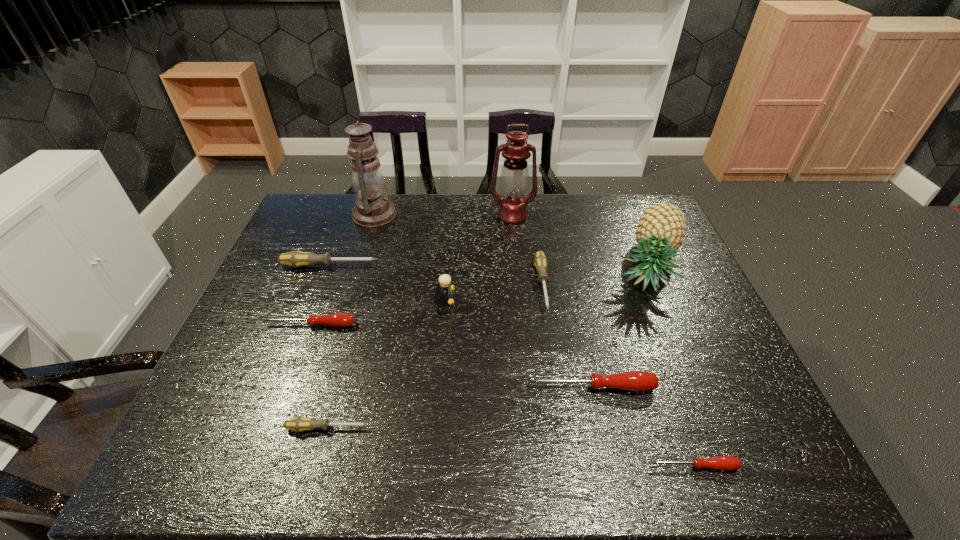
This screenshot has width=960, height=540. What are the coordinates of `the third farthest screwdriver` in the screenshot? It's located at (337, 319).

At what (x,y) coordinates should I click in order to perform the action: click on the smallest gray screwdriver. Please return your answer as a coordinate pair (x, y). Image resolution: width=960 pixels, height=540 pixels. Looking at the image, I should click on (298, 424).

Where is `the nearest gray screwdriver`? Image resolution: width=960 pixels, height=540 pixels. the nearest gray screwdriver is located at coordinates (298, 424).

I want to click on the nearest object, so click(x=726, y=463).

I want to click on the shortest object, so click(x=726, y=463).

Image resolution: width=960 pixels, height=540 pixels. I want to click on vacant area situated 0.280m on the left of the right oil lamp, so click(x=410, y=216).

You are a GUI agent. You are given a task and a screenshot of the screen. Output one action in this format:
    pyautogui.click(x=<x>, y=<y>)
    Task: Click on the free location located 0.350m on the front of the left oil lamp
    
    Given the screenshot: What is the action you would take?
    pyautogui.click(x=347, y=307)

Where is `free space located 0.140m on the front of the third tallest object`? free space located 0.140m on the front of the third tallest object is located at coordinates (680, 345).

Locate an element on the screen. free region located on the front-facing side of the fourth tallest object is located at coordinates (537, 301).

This screenshot has width=960, height=540. Identify the location of vacant space located 0.320m at the tip of the biggest gray screwdriver. (484, 266).